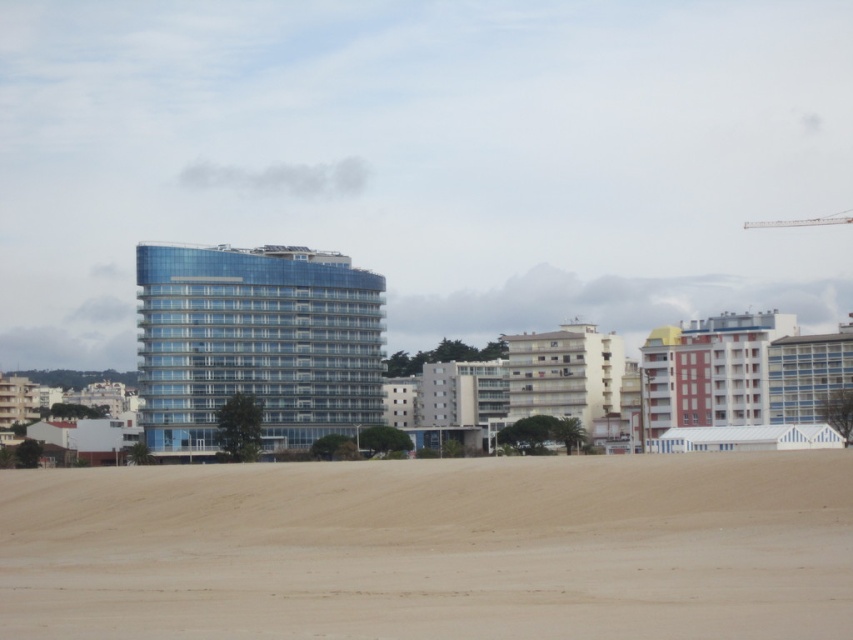
Question: Estimate the real-world distances between objects in this image. Which object is farther from the transparent glass building at center?

Choices:
 (A) white matte building at center
 (B) metallic gray crane at upper right

Answer: (B)

Question: Observing the image, what is the correct spatial positioning of white matte building at center in reference to metallic gray crane at upper right?

Choices:
 (A) right
 (B) left

Answer: (B)

Question: Estimate the real-world distances between objects in this image. Which object is closer to the white matte building at center?

Choices:
 (A) metallic gray crane at upper right
 (B) transparent glass building at center
 (C) beige sandy beach at lower center

Answer: (B)

Question: Does transparent glass building at center have a greater width compared to metallic gray crane at upper right?

Choices:
 (A) no
 (B) yes

Answer: (B)

Question: Can you confirm if white matte building at center is wider than metallic gray crane at upper right?

Choices:
 (A) no
 (B) yes

Answer: (A)

Question: Which object is positioned closest to the metallic gray crane at upper right?

Choices:
 (A) transparent glass building at center
 (B) white matte building at center

Answer: (B)